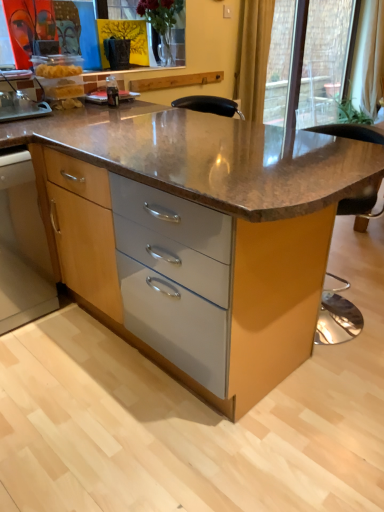
What is the approximate width of transparent glass door at upper right?

7.85 inches.

In order to face transparent glass door at upper right, should I rotate leftwards or rightwards?

Rotate right and turn 18.144 degrees.

Measure the distance between point (26, 162) and camera.

1.88 meters.

Locate an element on the screen. The width and height of the screenshot is (384, 512). yellow fabric curtain at upper right is located at coordinates (253, 57).

Locate an element on the screen. transparent glass door at upper right is located at coordinates (325, 58).

Which of these two, brown polished granite table at center or transparent glass door at upper right, is wider?

Wider between the two is brown polished granite table at center.

From the image's perspective, between brown polished granite table at center and transparent glass door at upper right, who is located below?

brown polished granite table at center is shown below in the image.

Is brown polished granite table at center next to transparent glass door at upper right?

brown polished granite table at center and transparent glass door at upper right are not in contact.

Is wooden cabinet at lower left not inside transparent glass door at upper right?

Yes, wooden cabinet at lower left is not within transparent glass door at upper right.

Could you tell me if wooden cabinet at lower left is turned towards transparent glass door at upper right?

No, wooden cabinet at lower left is not facing towards transparent glass door at upper right.

Would you say wooden cabinet at lower left is a long distance from transparent glass door at upper right?

Yes.

Measure the distance from wooden cabinet at lower left to transparent glass door at upper right.

A distance of 3.34 meters exists between wooden cabinet at lower left and transparent glass door at upper right.

From a real-world perspective, is wooden cabinet at lower left on yellow fabric curtain at upper right?

No.

In the image, is wooden cabinet at lower left positioned in front of or behind yellow fabric curtain at upper right?

Clearly, wooden cabinet at lower left is in front of yellow fabric curtain at upper right.

Consider the image. Is wooden cabinet at lower left smaller than yellow fabric curtain at upper right?

Incorrect, wooden cabinet at lower left is not smaller in size than yellow fabric curtain at upper right.

Looking at this image, can you confirm if wooden cabinet at lower left is positioned to the left of yellow fabric curtain at upper right?

Yes, wooden cabinet at lower left is to the left of yellow fabric curtain at upper right.

From a real-world perspective, is transparent glass door at upper right under yellow fabric curtain at upper right?

Yes, from a real-world perspective, transparent glass door at upper right is beneath yellow fabric curtain at upper right.

From the picture: How different are the orientations of transparent glass door at upper right and yellow fabric curtain at upper right in degrees?

There is a 2.66-degree angle between the facing directions of transparent glass door at upper right and yellow fabric curtain at upper right.

In the scene shown: From the image's perspective, does transparent glass door at upper right appear lower than yellow fabric curtain at upper right?

No, from the image's perspective, transparent glass door at upper right is not beneath yellow fabric curtain at upper right.

Considering the points (332, 16) and (250, 21), which point is behind, point (332, 16) or point (250, 21)?

The point (332, 16) is farther.

From the image's perspective, which is below, transparent glass door at upper right or wooden cabinet at lower left?

wooden cabinet at lower left, from the image's perspective.

Between transparent glass door at upper right and wooden cabinet at lower left, which one has more height?

transparent glass door at upper right is taller.

Who is smaller, transparent glass door at upper right or wooden cabinet at lower left?

wooden cabinet at lower left is smaller.

Would you consider transparent glass door at upper right to be distant from wooden cabinet at lower left?

transparent glass door at upper right is far away from wooden cabinet at lower left.

From the image's perspective, would you say wooden cabinet at lower left is positioned over brown polished granite table at center?

No, from the image's perspective, wooden cabinet at lower left is not over brown polished granite table at center.

Between point (15, 234) and point (368, 157), which one is positioned behind?

The point (15, 234) is farther.

Which of these two, wooden cabinet at lower left or brown polished granite table at center, is bigger?

brown polished granite table at center.

From a real-world perspective, is wooden cabinet at lower left over brown polished granite table at center?

No.

How distant is transparent glass door at upper right from brown polished granite table at center?

transparent glass door at upper right and brown polished granite table at center are 9.08 feet apart.

Considering the sizes of objects transparent glass door at upper right and brown polished granite table at center in the image provided, who is bigger, transparent glass door at upper right or brown polished granite table at center?

brown polished granite table at center is bigger.

Are transparent glass door at upper right and brown polished granite table at center making contact?

There is a gap between transparent glass door at upper right and brown polished granite table at center.

Does point (270, 103) appear closer or farther from the camera than point (230, 410)?

Clearly, point (270, 103) is more distant from the camera than point (230, 410).

Find the location of `table below the transparent glass door at upper right (from the image's perspective)`. table below the transparent glass door at upper right (from the image's perspective) is located at coordinates (203, 207).

In order to click on glass door that appears above the wooden cabinet at lower left (from the image's perspective) in this screenshot , I will do `click(325, 58)`.

When comparing their distances from transparent glass door at upper right, does yellow fabric curtain at upper right or wooden cabinet at lower left seem closer?

Based on the image, yellow fabric curtain at upper right appears to be nearer to transparent glass door at upper right.

Considering their positions, is yellow fabric curtain at upper right positioned closer to brown polished granite table at center than transparent glass door at upper right?

Based on the image, yellow fabric curtain at upper right appears to be nearer to brown polished granite table at center.

Considering their positions, is wooden cabinet at lower left positioned further to brown polished granite table at center than yellow fabric curtain at upper right?

The object further to brown polished granite table at center is yellow fabric curtain at upper right.

Looking at the image, which one is located closer to transparent glass door at upper right, brown polished granite table at center or yellow fabric curtain at upper right?

yellow fabric curtain at upper right lies closer to transparent glass door at upper right than the other object.

Based on their spatial positions, is wooden cabinet at lower left or brown polished granite table at center closer to yellow fabric curtain at upper right?

brown polished granite table at center.

Based on their spatial positions, is yellow fabric curtain at upper right or brown polished granite table at center closer to wooden cabinet at lower left?

brown polished granite table at center lies closer to wooden cabinet at lower left than the other object.

Looking at the image, which one is located closer to yellow fabric curtain at upper right, transparent glass door at upper right or brown polished granite table at center?

transparent glass door at upper right lies closer to yellow fabric curtain at upper right than the other object.

When comparing their distances from wooden cabinet at lower left, does brown polished granite table at center or transparent glass door at upper right seem closer?

Among the two, brown polished granite table at center is located nearer to wooden cabinet at lower left.

Image resolution: width=384 pixels, height=512 pixels. Identify the location of cabinetry between brown polished granite table at center and transparent glass door at upper right from front to back. (22, 246).

Find the location of `curtain located between wooden cabinet at lower left and transparent glass door at upper right in the left-right direction`. curtain located between wooden cabinet at lower left and transparent glass door at upper right in the left-right direction is located at coordinates [x=253, y=57].

Identify the location of curtain between brown polished granite table at center and transparent glass door at upper right in the front-back direction. (253, 57).

Where is `cabinetry between brown polished granite table at center and yellow fabric curtain at upper right in the front-back direction`? This screenshot has height=512, width=384. cabinetry between brown polished granite table at center and yellow fabric curtain at upper right in the front-back direction is located at coordinates (22, 246).